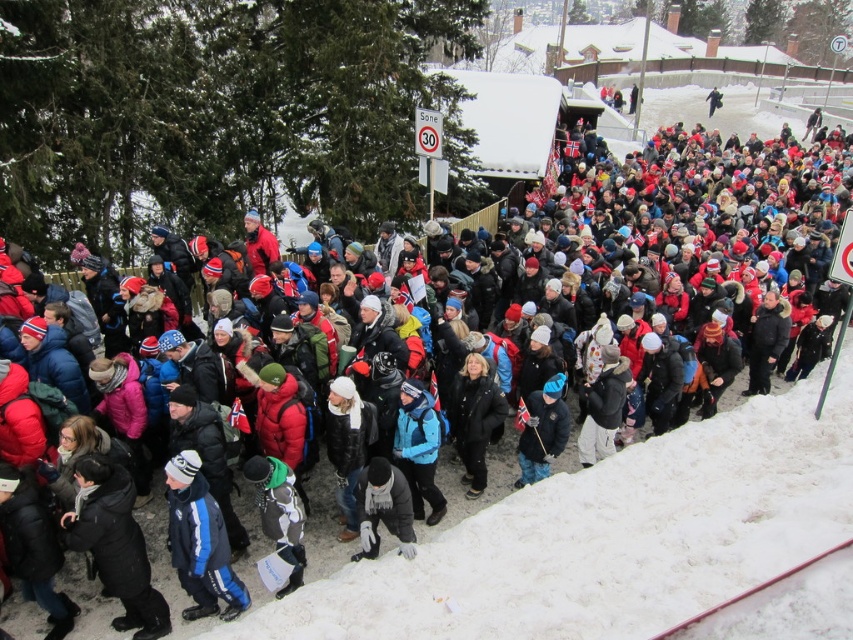
Question: Observing the image, what is the correct spatial positioning of blue fleece jacket at center in reference to blue woolen hat at center?

Choices:
 (A) left
 (B) right

Answer: (A)

Question: Does black matte coat at lower left lie behind dark gray wool scarf at center?

Choices:
 (A) yes
 (B) no

Answer: (B)

Question: Which point is closer to the camera taking this photo?

Choices:
 (A) (744, 532)
 (B) (471, 362)

Answer: (A)

Question: Based on their relative distances, which object is farther from the black matte coat at center?

Choices:
 (A) black matte coat at lower left
 (B) dark gray jacket at center
 (C) blue woolen hat at center

Answer: (A)

Question: Estimate the real-world distances between objects in this image. Which object is closer to the black matte coat at center?

Choices:
 (A) black matte coat at lower left
 (B) dark gray jacket at center
 (C) white snow at center
 (D) blue woolen hat at center

Answer: (D)

Question: Does blue fleece jacket at center appear on the left side of black matte coat at center?

Choices:
 (A) yes
 (B) no

Answer: (A)